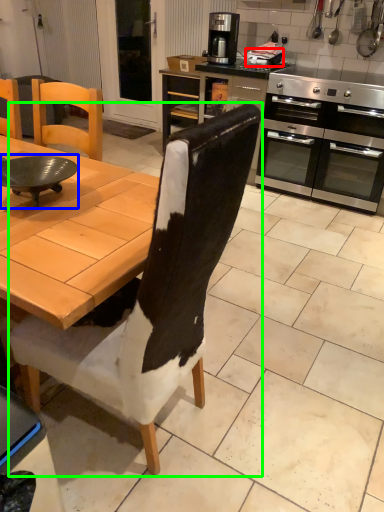
Question: Which object is positioned farthest from appliance (highlighted by a red box)? Select from round table (highlighted by a blue box) and chair (highlighted by a green box).

Choices:
 (A) round table
 (B) chair

Answer: (B)